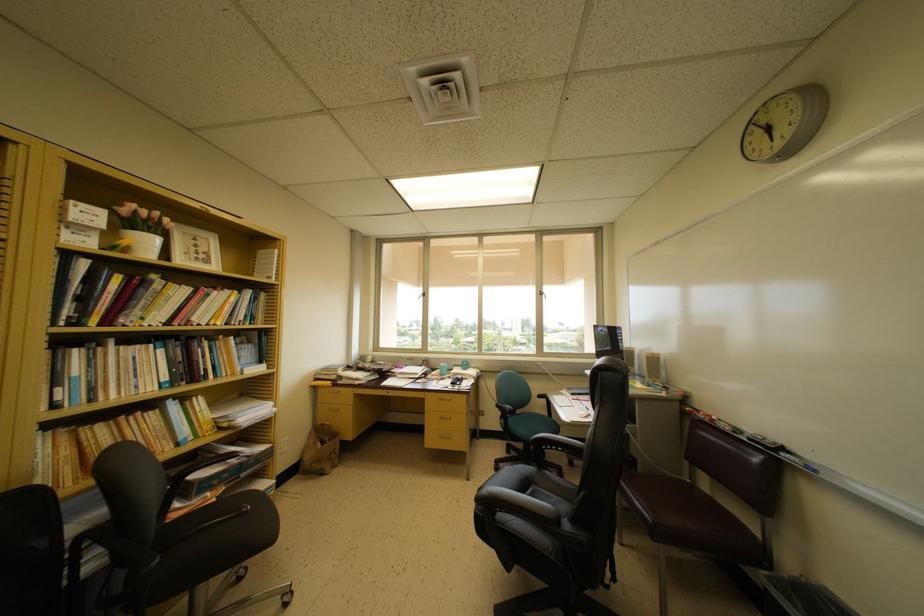
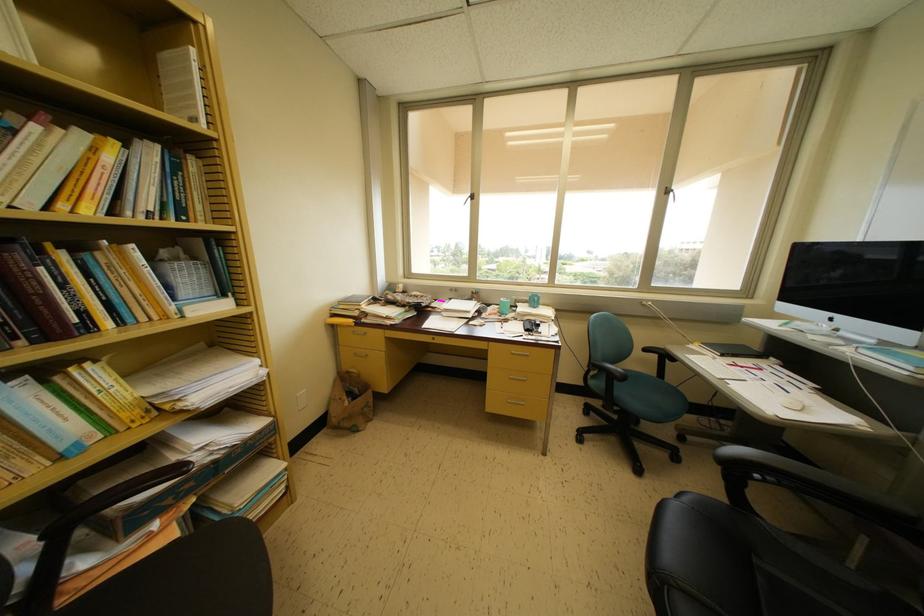
The point at (x=281, y=256) is marked in the first image. Where is the corresponding point in the second image?

(197, 55)